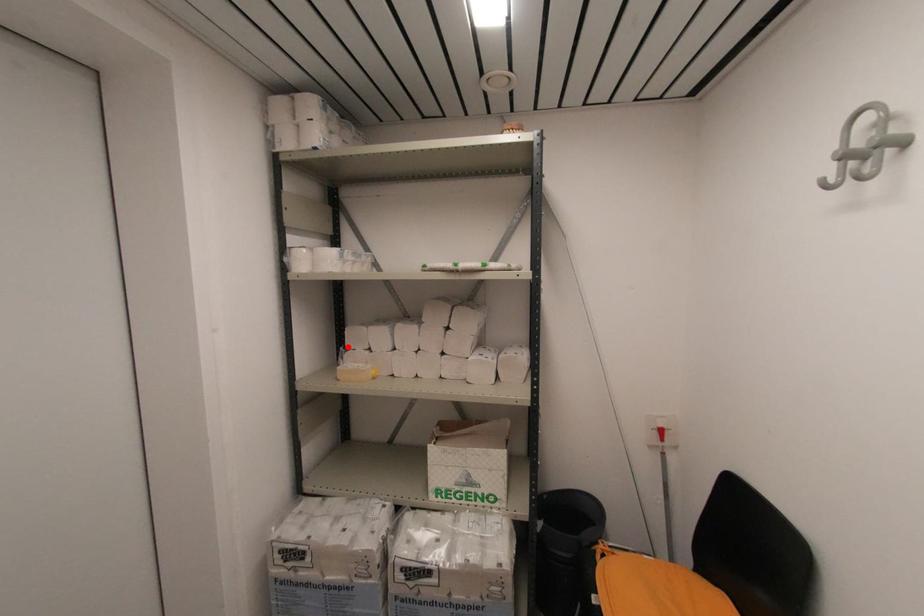
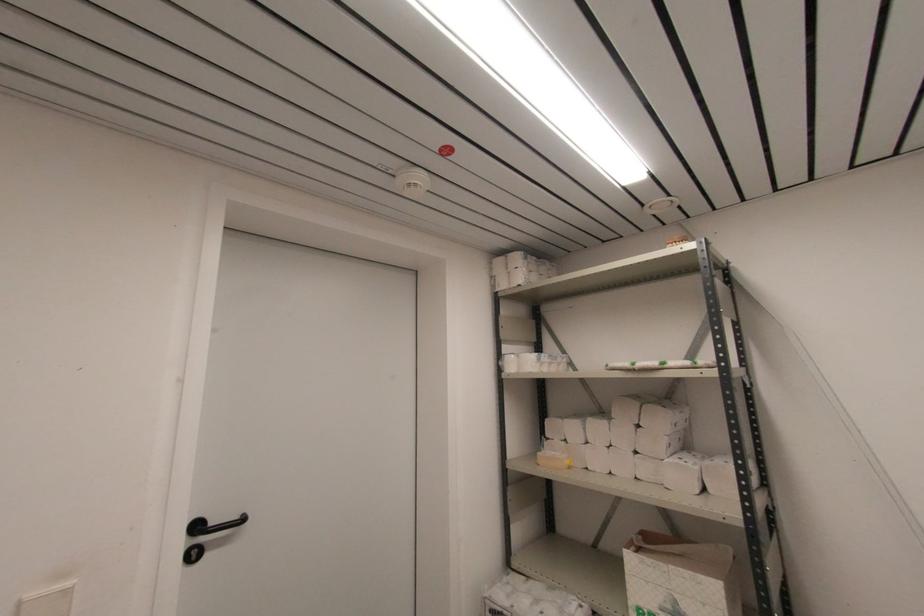
Locate, in the second image, the point that corresponds to the highlighted location in the first image.

(548, 436)